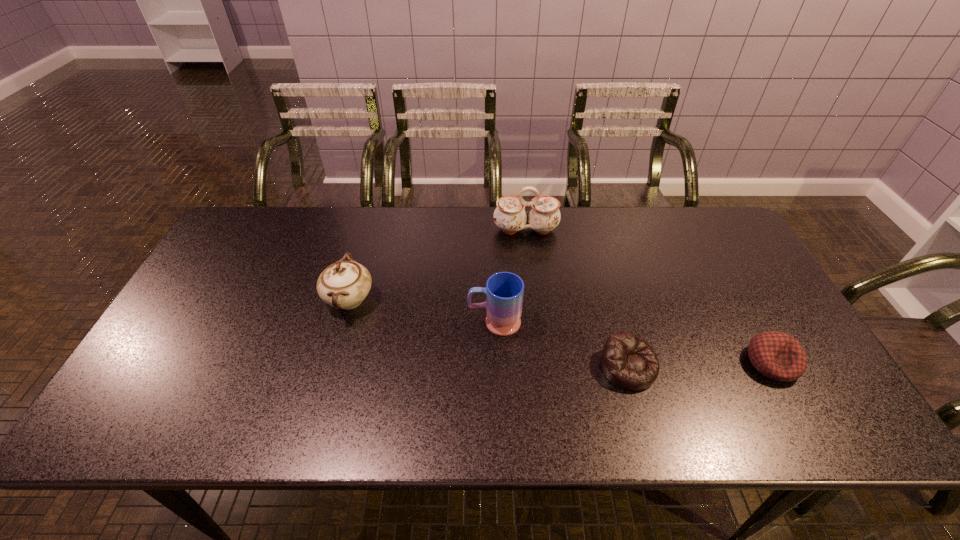
You are a GUI agent. You are given a task and a screenshot of the screen. Output one action in this format:
    pyautogui.click(x=<x>, y=<y>)
    Task: Click on the vacant space in between the farther chinaware and the second object from right to left
    Image resolution: width=960 pixels, height=540 pixels.
    Given the screenshot: What is the action you would take?
    pyautogui.click(x=577, y=298)

Image resolution: width=960 pixels, height=540 pixels. What are the coordinates of `free space between the leftmost object and the mug` in the screenshot? It's located at (421, 310).

At what (x,y) coordinates should I click in order to perform the action: click on empty location between the farther chinaware and the nearer chinaware. Please return your answer as a coordinate pair (x, y). Looking at the image, I should click on (438, 265).

The height and width of the screenshot is (540, 960). I want to click on blank region between the right beanbag and the farthest object, so click(649, 296).

The image size is (960, 540). Find the location of `vacant area that lies between the farther chinaware and the left beanbag`. vacant area that lies between the farther chinaware and the left beanbag is located at coordinates (577, 298).

Locate an element on the screen. blank region between the farthest object and the nearer chinaware is located at coordinates click(438, 265).

Where is `free space between the mug and the leftmost object`? free space between the mug and the leftmost object is located at coordinates (421, 310).

Locate an element on the screen. The image size is (960, 540). object that is the nearest to the right beanbag is located at coordinates (628, 361).

Identify the location of object that stands as the third closest to the right beanbag. The height and width of the screenshot is (540, 960). (510, 216).

Locate an element on the screen. free location that satisfies the following two spatial constraints: 1. by the handle of the right chinaware; 2. on the left side of the second object from right to left is located at coordinates (x=541, y=367).